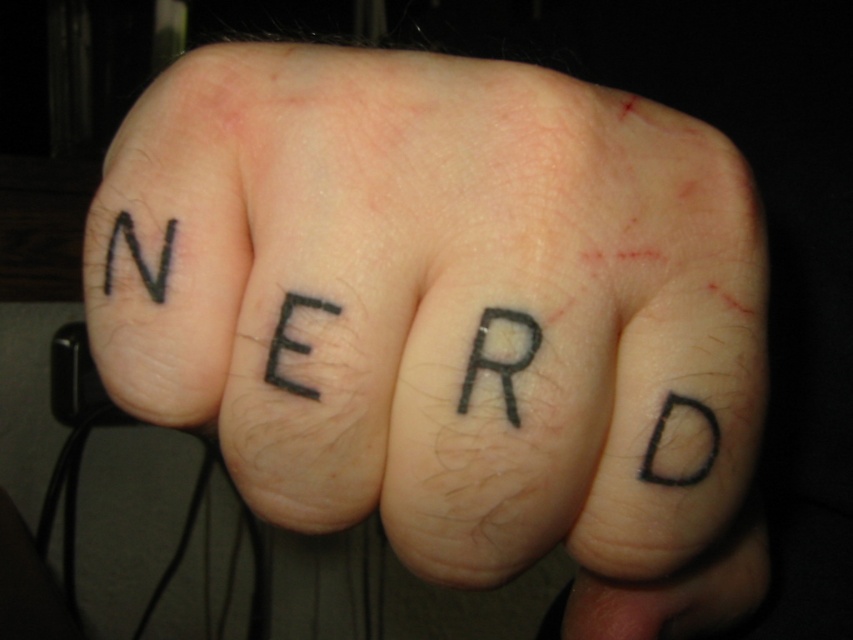
Question: Which object is farther from the camera taking this photo?

Choices:
 (A) black ink letter at upper left
 (B) black ink tattoo at center

Answer: (A)

Question: Does black ink tattoo at center appear over black ink letter at upper left?

Choices:
 (A) no
 (B) yes

Answer: (A)

Question: Can you confirm if black ink tattoo at center is wider than black ink letter at upper left?

Choices:
 (A) yes
 (B) no

Answer: (A)

Question: Is black ink tattoo at center closer to the viewer compared to black ink letter at upper left?

Choices:
 (A) yes
 (B) no

Answer: (A)